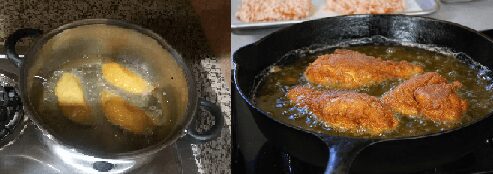
Where is `pot`? The image size is (493, 174). pot is located at coordinates (79, 32).